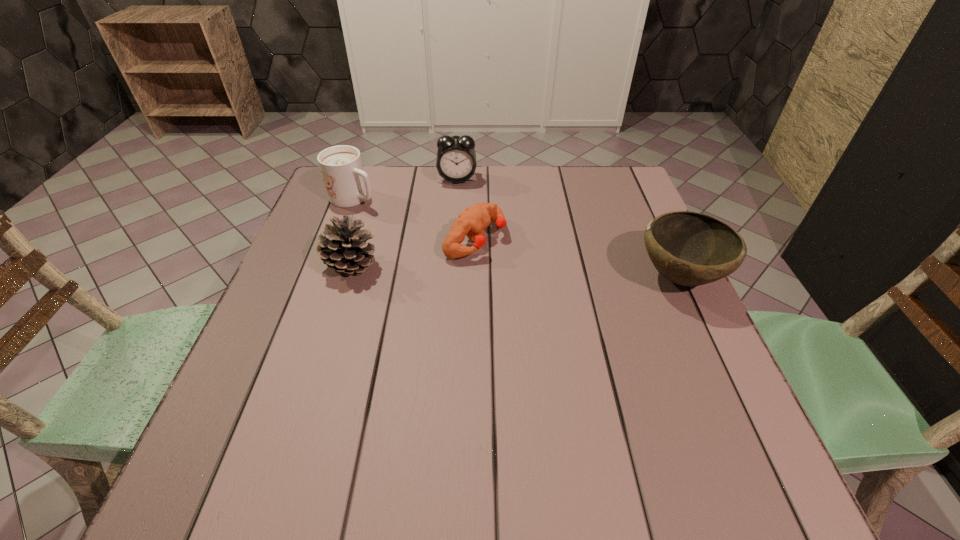
Where is `vacant space on the desktop that is between the pinecone and the bowl and is positioned on the front side of the alarm clock`? This screenshot has height=540, width=960. vacant space on the desktop that is between the pinecone and the bowl and is positioned on the front side of the alarm clock is located at coordinates (466, 269).

Where is `free space on the desktop that is between the pinecone and the rightmost object and is positioned with the gloves of the puncher facing forward`? free space on the desktop that is between the pinecone and the rightmost object and is positioned with the gloves of the puncher facing forward is located at coordinates (548, 273).

The height and width of the screenshot is (540, 960). In order to click on vacant space on the desktop that is between the pinecone and the rightmost object and is positioned on the side with the handle of the cappuccino in this screenshot , I will do `click(490, 271)`.